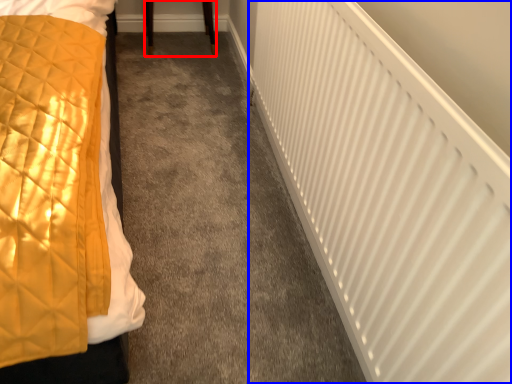
Question: Which object appears farthest to the camera in this image, furniture (highlighted by a red box) or radiator (highlighted by a blue box)?

Choices:
 (A) furniture
 (B) radiator

Answer: (A)